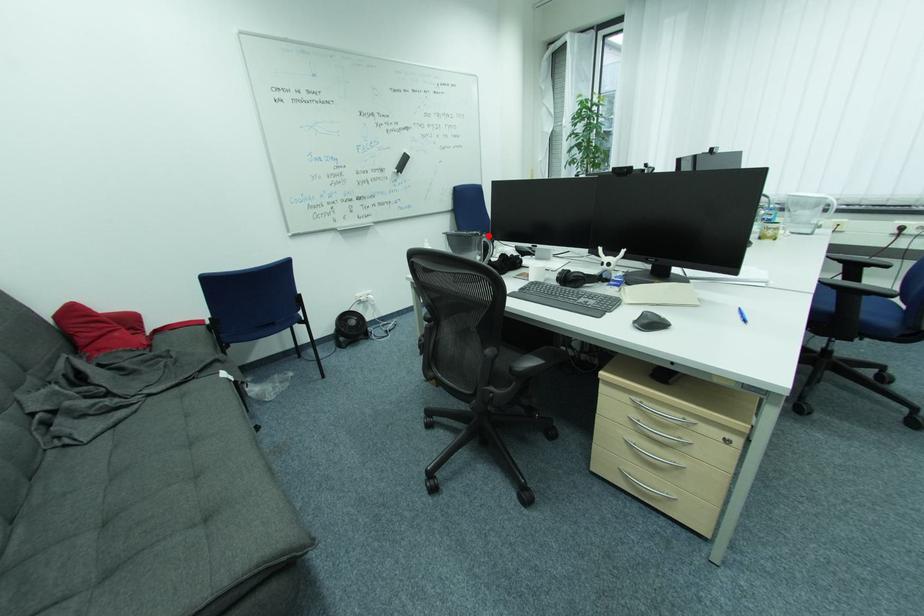
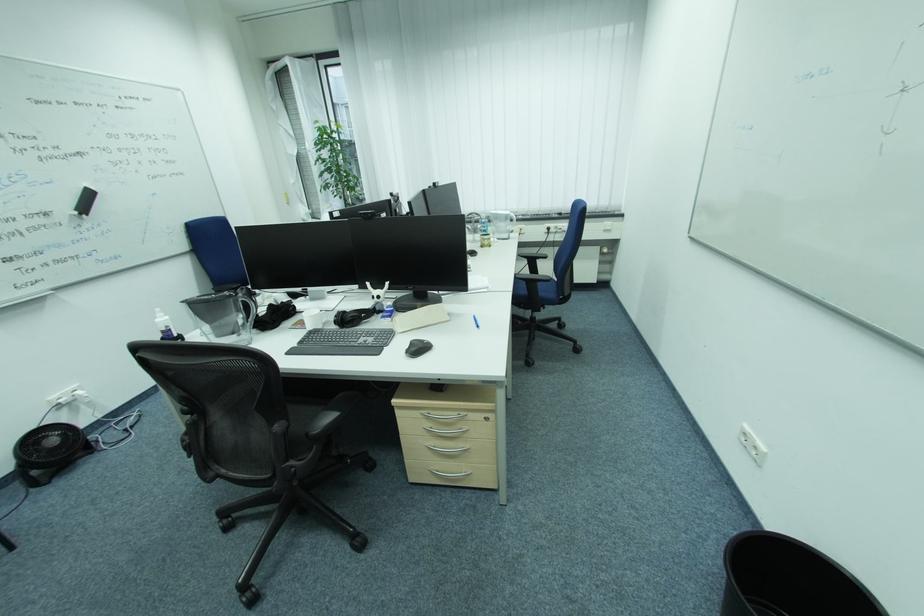
In the second image, find the point that corresponds to the highlighted location in the first image.

(242, 294)